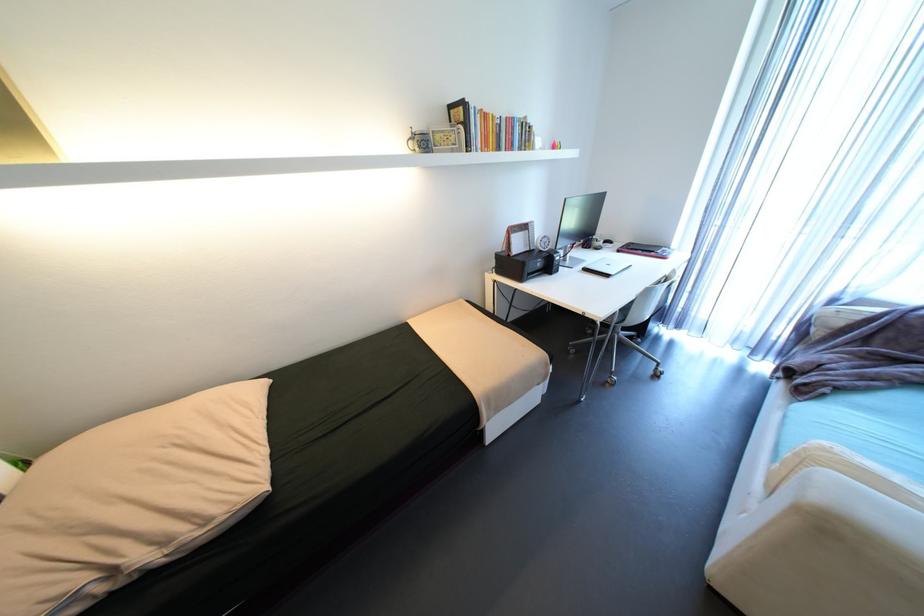
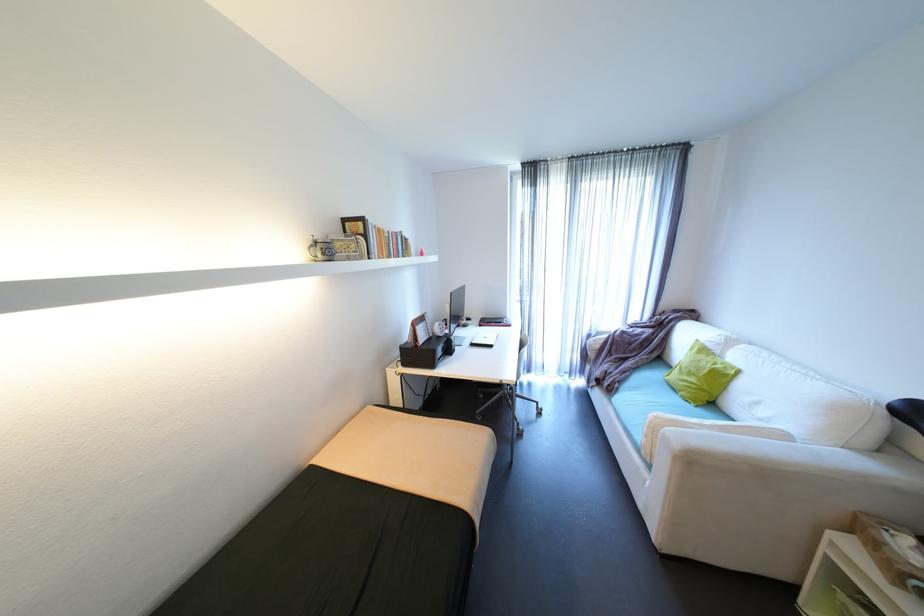
Question: I am providing you with two images of the same scene from different viewpoints. Which of the following objects are not visible in image2?

Choices:
 (A) green cushion
 (B) desk calendar
 (C) sofa sitting surface
 (D) none of these

Answer: (D)